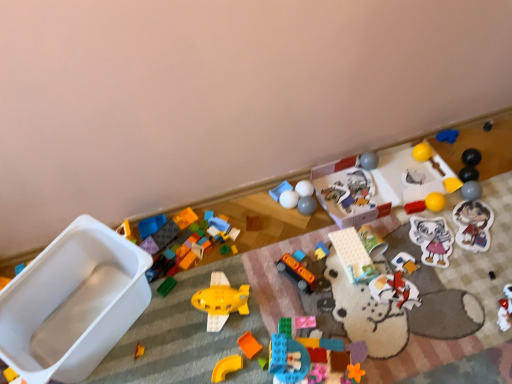
Identify the location of vacant space that is in between yellow matte square at center-right, placed as the 22th toy when sorted from left to right, and pink matte block at center, acting as the 14th toy starting from the right. (379, 255).